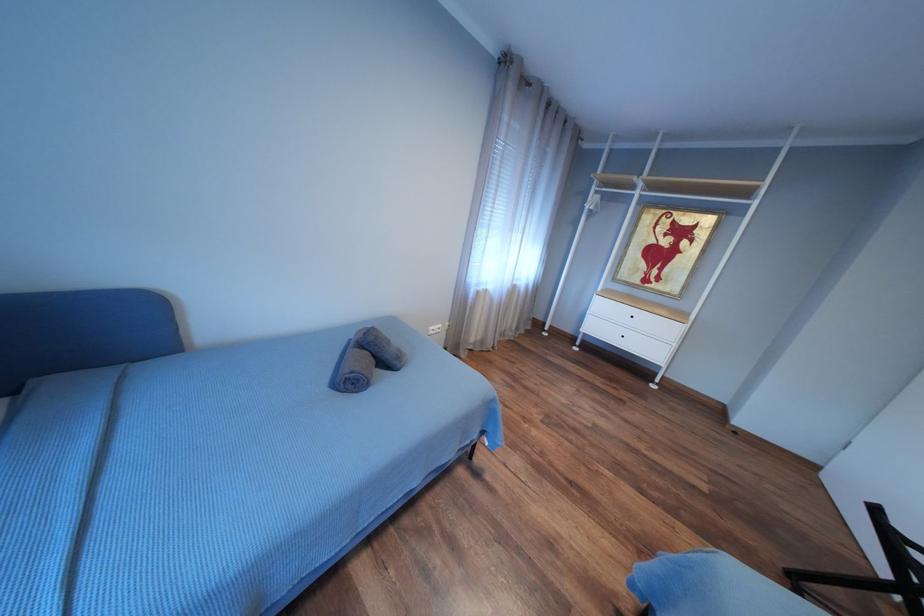
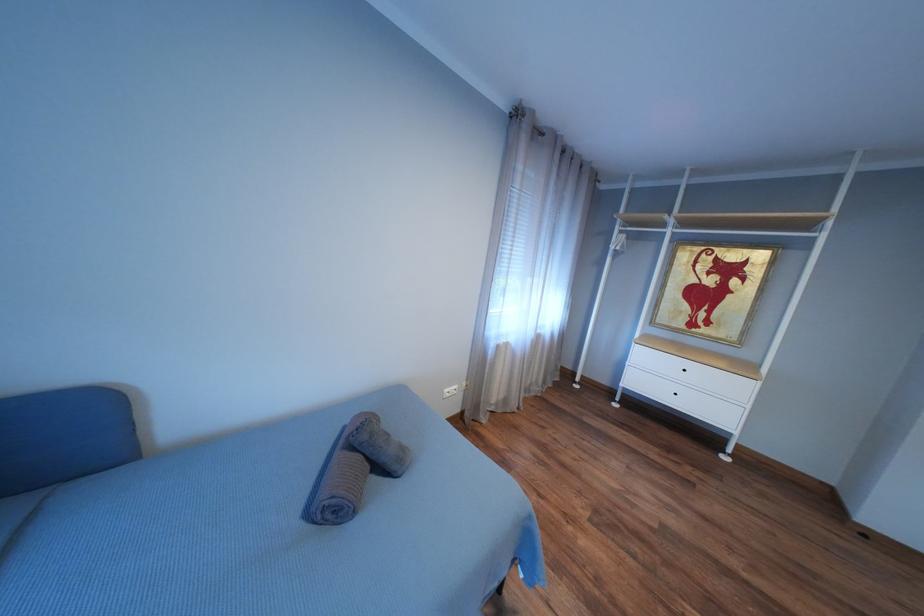
Question: The first image is from the beginning of the video and the second image is from the end. How did the camera likely rotate when shooting the video?

Choices:
 (A) Left
 (B) Right
 (C) Up
 (D) Down

Answer: (C)